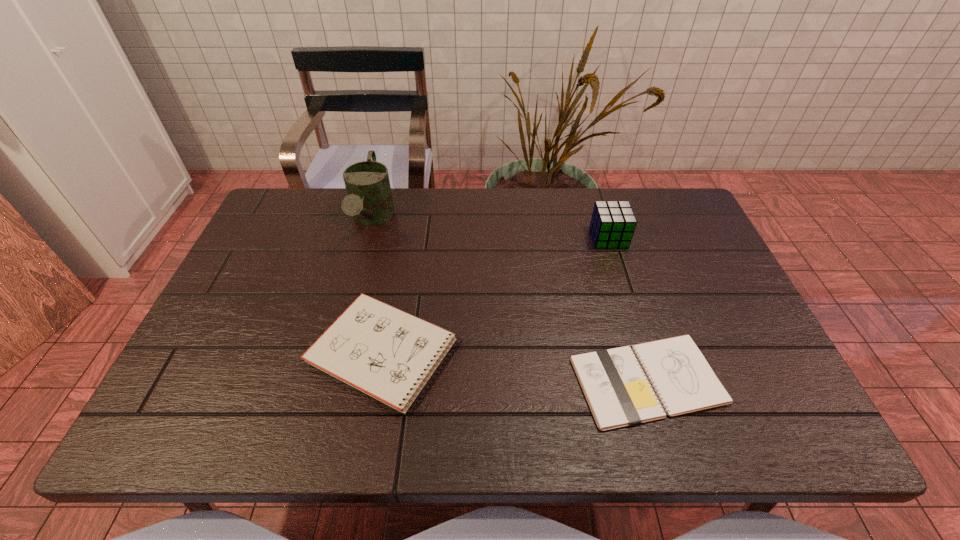
At what (x,y) coordinates should I click in order to perform the action: click on vacant point that satisfies the following two spatial constraints: 1. with the spout on the tallest object; 2. on the right side of the second shortest object. Please return your answer as a coordinate pair (x, y). This screenshot has height=540, width=960. Looking at the image, I should click on (336, 352).

At what (x,y) coordinates should I click in order to perform the action: click on free space that satisfies the following two spatial constraints: 1. with the spout on the tallest object; 2. on the right side of the shorter notepad. Please return your answer as a coordinate pair (x, y). Looking at the image, I should click on (328, 381).

The image size is (960, 540). In order to click on vacant space that satisfies the following two spatial constraints: 1. with the spout on the second tallest object; 2. on the left side of the tallest object in this screenshot , I will do `click(367, 238)`.